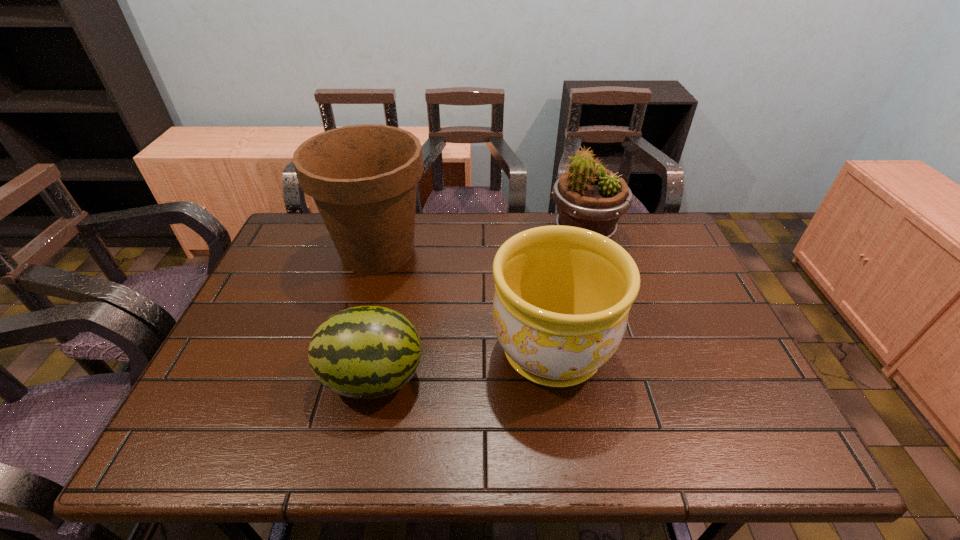
At what (x,y) coordinates should I click in order to perform the action: click on the leftmost flowerpot. Please return your answer as a coordinate pair (x, y). The image size is (960, 540). Looking at the image, I should click on (363, 178).

Locate an element on the screen. The width and height of the screenshot is (960, 540). the shortest flowerpot is located at coordinates (562, 296).

Where is `the nearest flowerpot`? the nearest flowerpot is located at coordinates (562, 296).

This screenshot has width=960, height=540. Find the location of `the shortest object`. the shortest object is located at coordinates (366, 351).

Locate an element on the screen. The width and height of the screenshot is (960, 540). vacant space situated on the right of the leftmost flowerpot is located at coordinates (453, 252).

Where is `vacant space positioned on the right of the third tallest object`? Image resolution: width=960 pixels, height=540 pixels. vacant space positioned on the right of the third tallest object is located at coordinates (699, 351).

You are a GUI agent. You are given a task and a screenshot of the screen. Output one action in this format:
    pyautogui.click(x=<x>, y=<y>)
    Task: Click on the vacant region located 0.190m at the stem end of the watermelon
    Image resolution: width=960 pixels, height=540 pixels.
    Given the screenshot: What is the action you would take?
    pyautogui.click(x=507, y=378)

Identify the location of object located in the left edge section of the desktop. The width and height of the screenshot is (960, 540). (363, 178).

Image resolution: width=960 pixels, height=540 pixels. In order to click on object that is positioned at the far left corner in this screenshot , I will do `click(363, 178)`.

Locate an element on the screen. vacant space at the far edge of the desktop is located at coordinates (479, 240).